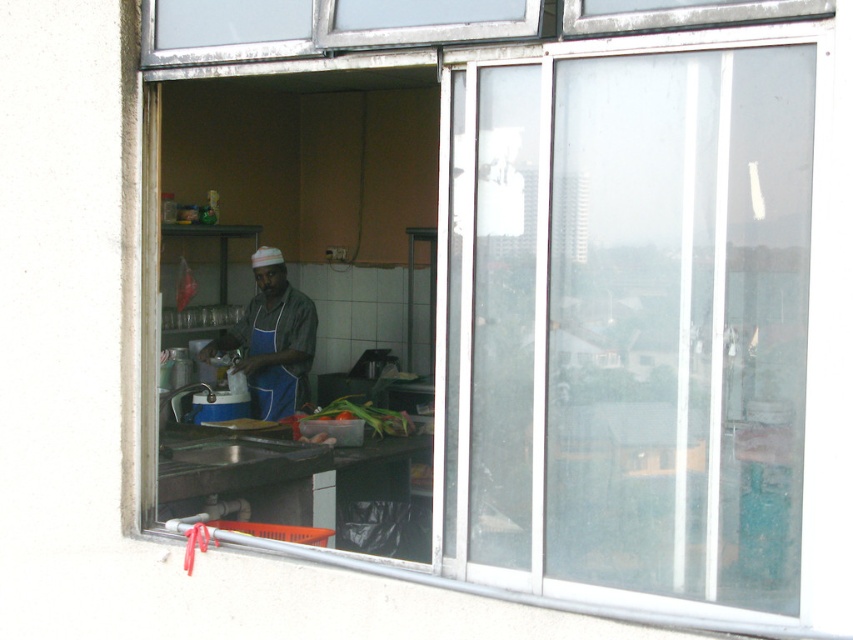
Is point (281, 384) positioned in front of point (412, 428)?

No, it is not.

The image size is (853, 640). Find the location of `blue fabric apron at center`. blue fabric apron at center is located at coordinates (271, 392).

In the scene shown: Which of these two, blue apron at center or blue fabric apron at center, stands taller?

With more height is blue apron at center.

Who is higher up, blue apron at center or blue fabric apron at center?

blue apron at center is higher up.

Who is more forward, (276, 394) or (258, 349)?

Point (276, 394) is in front.

In order to click on blue apron at center in this screenshot , I will do `click(271, 339)`.

Can you confirm if blue apron at center is shorter than translucent plastic container at center?

Incorrect, blue apron at center's height does not fall short of translucent plastic container at center's.

Does point (276, 298) lie in front of point (294, 417)?

No, it is not.

In the scene shown: Who is more forward, (305, 337) or (338, 406)?

Positioned in front is point (338, 406).

Identify the location of blue apron at center. (271, 339).